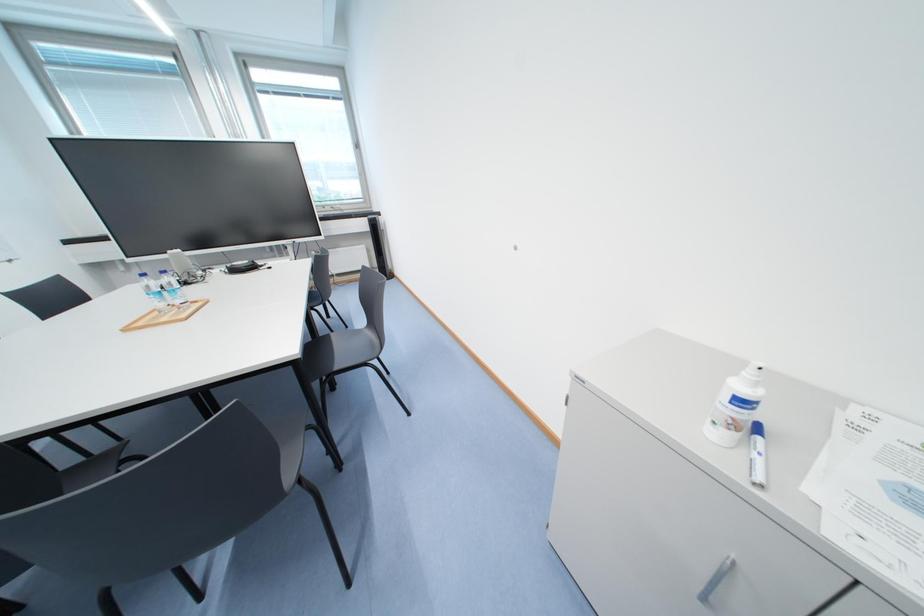
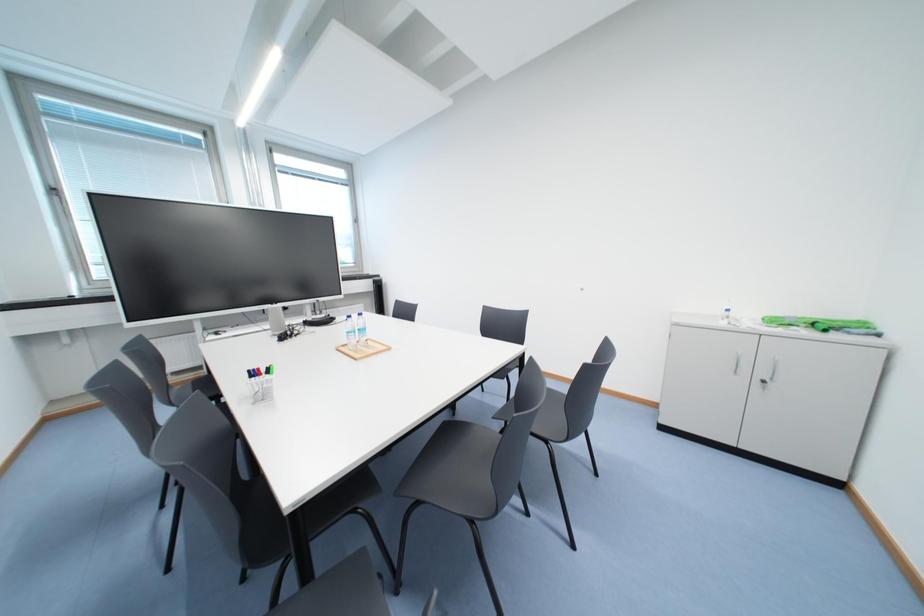
Question: In a continuous first-person perspective shot, in which direction is the camera moving?

Choices:
 (A) Left
 (B) Right
 (C) Forward
 (D) Backward

Answer: (A)